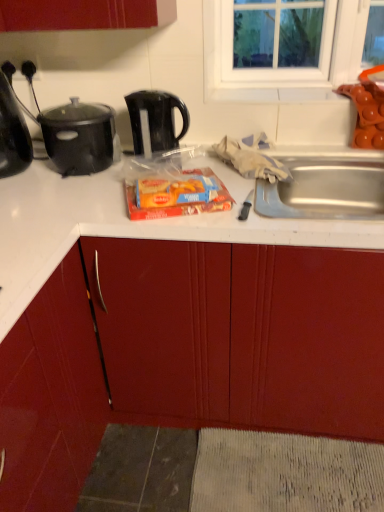
Question: From a real-world perspective, relative to shiny black kettle at left, is black plastic kettle at upper center vertically above or below?

Choices:
 (A) above
 (B) below

Answer: (B)

Question: Is black plastic kettle at upper center taller or shorter than shiny black kettle at left?

Choices:
 (A) short
 (B) tall

Answer: (A)

Question: Which object is positioned farthest from the shiny black kettle at left?

Choices:
 (A) black plastic kettle at upper center
 (B) matte plastic snack pack at center
 (C) matte red cabinet at center
 (D) black matte pot at upper left

Answer: (C)

Question: Based on their relative distances, which object is nearer to the black matte pot at upper left?

Choices:
 (A) matte red cabinet at center
 (B) shiny black kettle at left
 (C) matte plastic snack pack at center
 (D) black plastic kettle at upper center

Answer: (B)